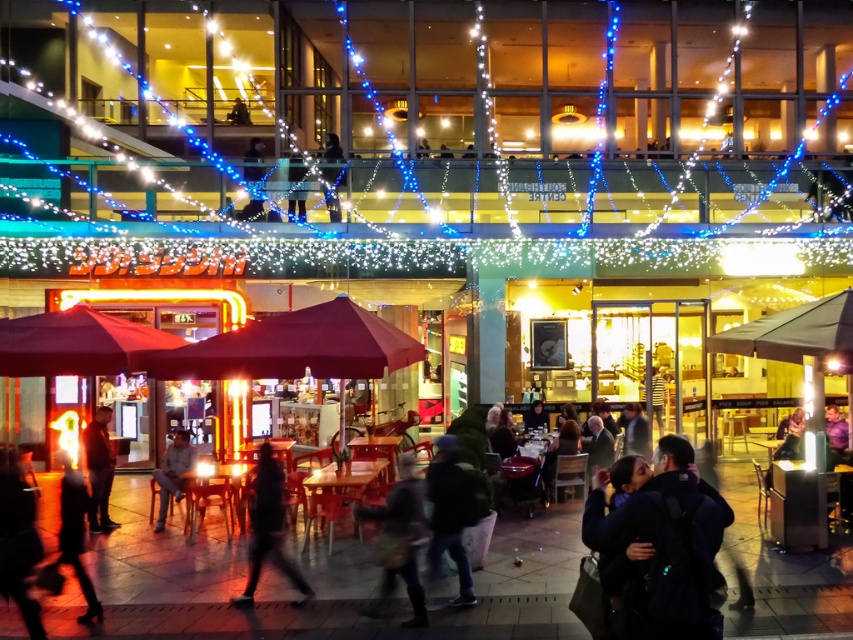
Question: From the image, what is the correct spatial relationship of dark blue jacket at lower right in relation to light brown leather jacket at lower left?

Choices:
 (A) right
 (B) left

Answer: (A)

Question: Does dark gray jacket at center have a greater width compared to dark brown leather jacket at lower left?

Choices:
 (A) no
 (B) yes

Answer: (A)

Question: Does maroon fabric umbrella at center have a smaller size compared to dark brown leather jacket at lower left?

Choices:
 (A) no
 (B) yes

Answer: (A)

Question: Which object is farther from the camera taking this photo?

Choices:
 (A) dark blue jeans at center
 (B) dark hair at lower left
 (C) dark brown leather jacket at lower left

Answer: (C)

Question: Which object appears farthest from the camera in this image?

Choices:
 (A) dark hair at lower left
 (B) maroon fabric umbrella at center
 (C) light brown leather jacket at lower left
 (D) dark fabric jacket at lower left

Answer: (C)

Question: Among these objects, which one is farthest from the camera?

Choices:
 (A) dark fabric jacket at lower left
 (B) dark hair at lower left
 (C) white string lights at upper center
 (D) dark blue jeans at center

Answer: (C)